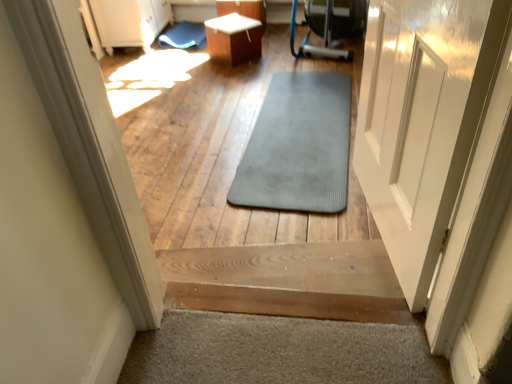
You are a GUI agent. You are given a task and a screenshot of the screen. Output one action in this format:
    pyautogui.click(x=<x>, y=<y>)
    Task: Click on the blue rubber mat at upper center, the second mat in the front-to-back sequence
    
    Given the screenshot: What is the action you would take?
    pyautogui.click(x=184, y=36)

The height and width of the screenshot is (384, 512). I want to click on white glossy table at center, so click(x=233, y=38).

Identify the location of blue rubber mat at upper center, the 2th mat in the bottom-to-top sequence. (184, 36).

Can we say gray rubber mat at center lies outside blue rubber mat at upper center, the 2th mat in the bottom-to-top sequence?

Yes.

From a real-world perspective, is gray rubber mat at center physically below blue rubber mat at upper center, the 2th mat in the bottom-to-top sequence?

Incorrect, from a real-world perspective, gray rubber mat at center is higher than blue rubber mat at upper center, the 2th mat in the bottom-to-top sequence.

What are the coordinates of `path below the blue rubber mat at upper center, the 1th mat from the top (from the image's perspective)` in the screenshot? It's located at (249, 208).

Between gray rubber mat at center and blue rubber mat at upper center, acting as the 1th mat starting from the left, which one has smaller size?

blue rubber mat at upper center, acting as the 1th mat starting from the left, is smaller.

Is wooden stairs at center facing towards blue rubber mat at upper center, which is the 1th mat from back to front?

Yes.

Does wooden stairs at center appear on the left side of blue rubber mat at upper center, the 1th mat from the top?

No, wooden stairs at center is not to the left of blue rubber mat at upper center, the 1th mat from the top.

Could you measure the distance between wooden stairs at center and blue rubber mat at upper center, the second mat in the front-to-back sequence?

wooden stairs at center and blue rubber mat at upper center, the second mat in the front-to-back sequence, are 3.08 meters apart.

Can you see wooden stairs at center touching blue rubber mat at upper center, the second mat in the front-to-back sequence?

wooden stairs at center and blue rubber mat at upper center, the second mat in the front-to-back sequence, are clearly separated.

From a real-world perspective, is wooden stairs at center located higher than gray rubber mat at center?

Actually, wooden stairs at center is physically below gray rubber mat at center in the real world.

From the image's perspective, is wooden stairs at center located above or below gray rubber mat at center?

From the image's perspective, wooden stairs at center appears below gray rubber mat at center.

Which of these two, wooden stairs at center or gray rubber mat at center, is wider?

Wider between the two is wooden stairs at center.

Where is `stairs that is on the right side of gray rubber mat at center`? The height and width of the screenshot is (384, 512). stairs that is on the right side of gray rubber mat at center is located at coordinates (288, 281).

Is gray rubber mat at center, which is the 2th mat in top-to-bottom order, inside white glossy table at center?

No, gray rubber mat at center, which is the 2th mat in top-to-bottom order, is located outside of white glossy table at center.

From the image's perspective, between white glossy table at center and gray rubber mat at center, which is the 2th mat in top-to-bottom order, which one is located above?

white glossy table at center, from the image's perspective.

From a real-world perspective, is white glossy table at center on top of gray rubber mat at center, which appears as the second mat when viewed from the back?

Yes, from a real-world perspective, white glossy table at center is above gray rubber mat at center, which appears as the second mat when viewed from the back.

Is white glossy table at center thinner than gray rubber mat at center, which appears as the second mat when viewed from the back?

Yes.

Is blue rubber mat at upper center, the 1th mat from the top, far from gray rubber mat at center?

Indeed, blue rubber mat at upper center, the 1th mat from the top, is not near gray rubber mat at center.

Which of these two, blue rubber mat at upper center, acting as the 1th mat starting from the left, or gray rubber mat at center, stands shorter?

With less height is blue rubber mat at upper center, acting as the 1th mat starting from the left.

Is blue rubber mat at upper center, acting as the 1th mat starting from the left, smaller than gray rubber mat at center?

Yes, blue rubber mat at upper center, acting as the 1th mat starting from the left, is smaller than gray rubber mat at center.

From a real-world perspective, who is located higher, wooden stairs at center or white glossy table at center?

white glossy table at center is physically above.

You are a GUI agent. You are given a task and a screenshot of the screen. Output one action in this format:
    pyautogui.click(x=<x>, y=<y>)
    Task: Click on the stairs located below the white glossy table at center (from the image's perspective)
    This screenshot has width=512, height=384.
    Given the screenshot: What is the action you would take?
    pyautogui.click(x=288, y=281)

Is wooden stairs at center far away from white glossy table at center?

wooden stairs at center is far away from white glossy table at center.

Could you tell me if wooden stairs at center is turned towards white glossy table at center?

Yes, wooden stairs at center is facing white glossy table at center.

In terms of height, does gray rubber mat at center, which ranks as the 1th mat in right-to-left order, look taller or shorter compared to gray rubber mat at center?

Clearly, gray rubber mat at center, which ranks as the 1th mat in right-to-left order, is shorter compared to gray rubber mat at center.

From a real-world perspective, which object stands above the other?

gray rubber mat at center is physically above.

Is gray rubber mat at center, which ranks as the 2th mat in left-to-right order, positioned with its back to gray rubber mat at center?

gray rubber mat at center, which ranks as the 2th mat in left-to-right order, is not turned away from gray rubber mat at center.

How many degrees apart are the facing directions of gray rubber mat at center, which ranks as the 1th mat in right-to-left order, and gray rubber mat at center?

There is a 178-degree angle between the facing directions of gray rubber mat at center, which ranks as the 1th mat in right-to-left order, and gray rubber mat at center.

At what (x,y) coordinates should I click in order to perform the action: click on mat on the left of the gray rubber mat at center. Please return your answer as a coordinate pair (x, y). Looking at the image, I should click on (184, 36).

Identify the location of stairs lying below the blue rubber mat at upper center, which is the 1th mat from back to front (from the image's perspective). This screenshot has width=512, height=384. (288, 281).

Considering their positions, is wooden stairs at center positioned further to blue rubber mat at upper center, acting as the 1th mat starting from the left, than white glossy table at center?

Based on the image, wooden stairs at center appears to be further to blue rubber mat at upper center, acting as the 1th mat starting from the left.

Estimate the real-world distances between objects in this image. Which object is closer to gray rubber mat at center, gray rubber mat at center, which is the first mat from front to back, or blue rubber mat at upper center, which is counted as the second mat, starting from the right?

Based on the image, gray rubber mat at center, which is the first mat from front to back, appears to be nearer to gray rubber mat at center.

Considering their positions, is gray rubber mat at center, which ranks as the 1th mat in right-to-left order, positioned closer to blue rubber mat at upper center, the 2th mat in the bottom-to-top sequence, than wooden stairs at center?

Based on the image, gray rubber mat at center, which ranks as the 1th mat in right-to-left order, appears to be nearer to blue rubber mat at upper center, the 2th mat in the bottom-to-top sequence.

From the picture: Estimate the real-world distances between objects in this image. Which object is closer to gray rubber mat at center, positioned as the first mat in bottom-to-top order, blue rubber mat at upper center, which is counted as the second mat, starting from the right, or white glossy table at center?

Based on the image, white glossy table at center appears to be nearer to gray rubber mat at center, positioned as the first mat in bottom-to-top order.

Based on their spatial positions, is white glossy table at center or gray rubber mat at center, which appears as the second mat when viewed from the back, further from wooden stairs at center?

Based on the image, white glossy table at center appears to be further to wooden stairs at center.

Estimate the real-world distances between objects in this image. Which object is further from wooden stairs at center, gray rubber mat at center, which is the 2th mat in top-to-bottom order, or blue rubber mat at upper center, which is the 1th mat from back to front?

Among the two, blue rubber mat at upper center, which is the 1th mat from back to front, is located further to wooden stairs at center.

Considering their positions, is wooden stairs at center positioned further to white glossy table at center than gray rubber mat at center?

wooden stairs at center is further to white glossy table at center.

Estimate the real-world distances between objects in this image. Which object is further from blue rubber mat at upper center, the 2th mat in the bottom-to-top sequence, white glossy table at center or gray rubber mat at center, which ranks as the 1th mat in right-to-left order?

gray rubber mat at center, which ranks as the 1th mat in right-to-left order, lies further to blue rubber mat at upper center, the 2th mat in the bottom-to-top sequence, than the other object.

This screenshot has height=384, width=512. Identify the location of table positioned between gray rubber mat at center, which ranks as the 2th mat in left-to-right order, and blue rubber mat at upper center, acting as the 1th mat starting from the left, from near to far. (233, 38).

You are a GUI agent. You are given a task and a screenshot of the screen. Output one action in this format:
    pyautogui.click(x=<x>, y=<y>)
    Task: Click on the stairs between gray rubber mat at center and gray rubber mat at center, which ranks as the 1th mat in right-to-left order, along the z-axis
    The width and height of the screenshot is (512, 384).
    Given the screenshot: What is the action you would take?
    point(288,281)

Identify the location of mat between wooden stairs at center and white glossy table at center in the front-back direction. [x=298, y=146].

This screenshot has width=512, height=384. I want to click on table located between wooden stairs at center and blue rubber mat at upper center, the 1th mat from the top, in the depth direction, so click(233, 38).